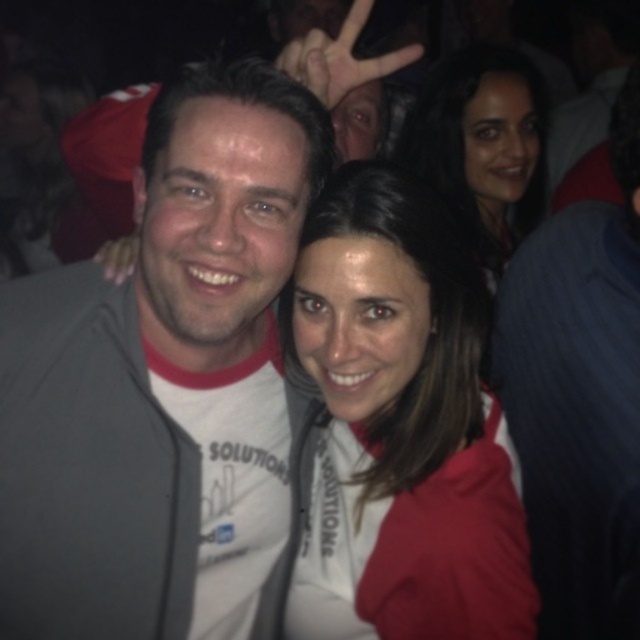
Question: Does gray fabric jacket at center appear on the right side of matte white hoodie at center?

Choices:
 (A) yes
 (B) no

Answer: (B)

Question: Considering the relative positions of gray fabric jacket at center and matte white hoodie at center in the image provided, where is gray fabric jacket at center located with respect to matte white hoodie at center?

Choices:
 (A) right
 (B) left

Answer: (B)

Question: Which of the following is the closest to the observer?

Choices:
 (A) matte white hoodie at center
 (B) gray fabric jacket at center
 (C) smooth dark hair at upper right

Answer: (B)

Question: Can you confirm if gray fabric jacket at center is bigger than matte white hoodie at center?

Choices:
 (A) yes
 (B) no

Answer: (A)

Question: Which point is closer to the camera?

Choices:
 (A) (163, 397)
 (B) (506, 490)
 (C) (451, 116)

Answer: (B)

Question: Which of the following is the farthest from the observer?

Choices:
 (A) matte white hoodie at center
 (B) gray fabric jacket at center
 (C) smooth dark hair at upper right

Answer: (C)